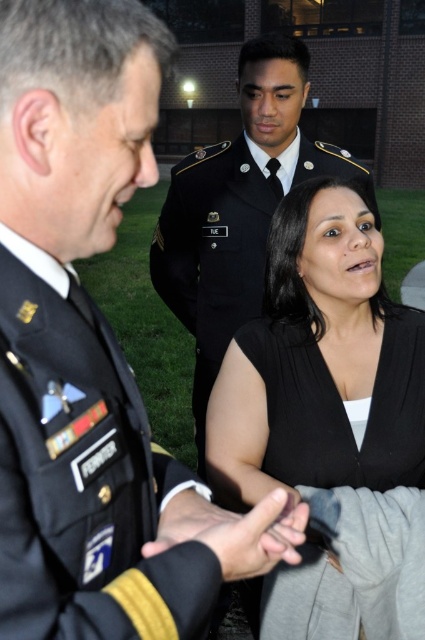
Which is behind, point (19, 182) or point (240, 564)?

Positioned behind is point (240, 564).

Is dark green uniform at center thinner than black matte hand at center?

Incorrect, dark green uniform at center's width is not less than black matte hand at center's.

Which is in front, point (81, 584) or point (234, 531)?

Point (81, 584) is in front.

You are a GUI agent. You are given a task and a screenshot of the screen. Output one action in this format:
    pyautogui.click(x=<x>, y=<y>)
    Task: Click on the dark green uniform at center
    The height and width of the screenshot is (640, 425).
    Given the screenshot: What is the action you would take?
    pyautogui.click(x=76, y=186)

Is dark green uniform at center thinner than dark green military uniform at center?

Correct, dark green uniform at center's width is less than dark green military uniform at center's.

Can you confirm if dark green uniform at center is wider than dark green military uniform at center?

In fact, dark green uniform at center might be narrower than dark green military uniform at center.

This screenshot has height=640, width=425. What are the coordinates of `dark green uniform at center` in the screenshot? It's located at (76, 186).

Does dark green military uniform at center appear on the left side of black matte hand at center?

In fact, dark green military uniform at center is to the right of black matte hand at center.

Can you confirm if dark green military uniform at center is positioned below black matte hand at center?

Actually, dark green military uniform at center is above black matte hand at center.

Where is `dark green military uniform at center`? The image size is (425, 640). dark green military uniform at center is located at coordinates (212, 256).